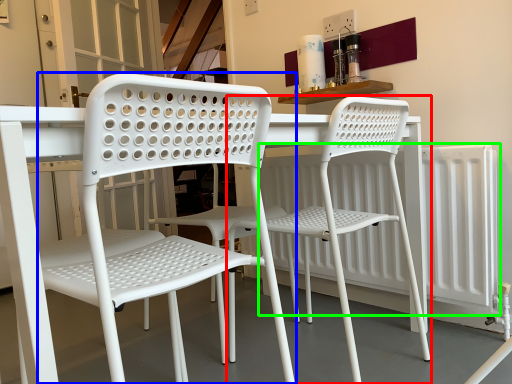
Question: Estimate the real-world distances between objects in this image. Which object is farther from chair (highlighted by a red box), chair (highlighted by a blue box) or radiator (highlighted by a green box)?

Choices:
 (A) chair
 (B) radiator

Answer: (A)